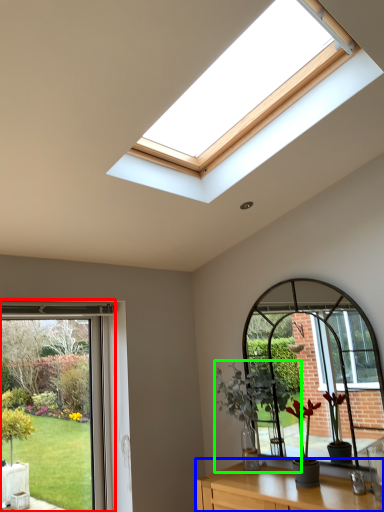
Question: Estimate the real-world distances between objects in this image. Which object is closer to window (highlighted by a red box), table (highlighted by a blue box) or houseplant (highlighted by a green box)?

Choices:
 (A) table
 (B) houseplant

Answer: (B)